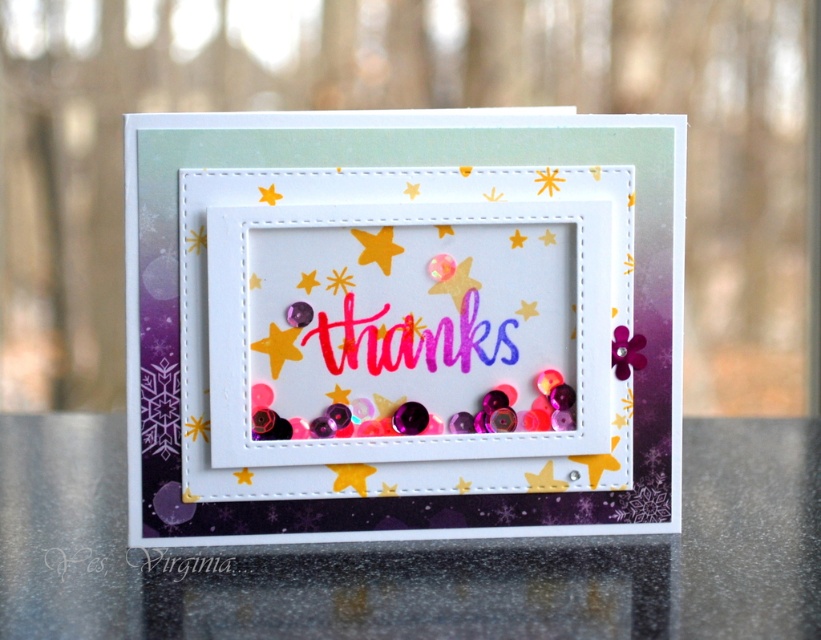
Does white paper at center appear under shiny metallic table at center?

Incorrect, white paper at center is not positioned below shiny metallic table at center.

Is point (187, 179) closer to camera compared to point (31, 620)?

No.

At what (x,y) coordinates should I click in order to perform the action: click on white paper at center. Please return your answer as a coordinate pair (x, y). The image size is (821, 640). Looking at the image, I should click on (401, 324).

Can you confirm if white paper at center is smaller than metallic gold star at center?

Actually, white paper at center might be larger than metallic gold star at center.

Who is lower down, white paper at center or metallic gold star at center?

Positioned lower is white paper at center.

What do you see at coordinates (401, 324) in the screenshot? The width and height of the screenshot is (821, 640). I see `white paper at center` at bounding box center [401, 324].

The image size is (821, 640). What are the coordinates of `white paper at center` in the screenshot? It's located at (401, 324).

Between shiny metallic table at center and metallic gold star at center, which one is positioned lower?

shiny metallic table at center

Is point (794, 541) closer to camera compared to point (372, 243)?

No, (794, 541) is further to viewer.

Is point (352, 618) more distant than point (388, 252)?

No, it is not.

Identify the location of shiny metallic table at center. (415, 556).